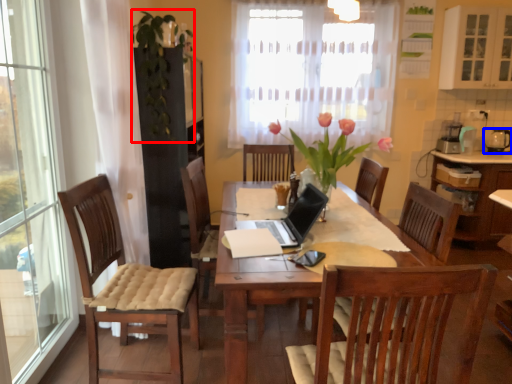
Question: Which of the following is the closest to the observer, floral arrangement (highlighted by a red box) or tableware (highlighted by a blue box)?

Choices:
 (A) floral arrangement
 (B) tableware

Answer: (A)